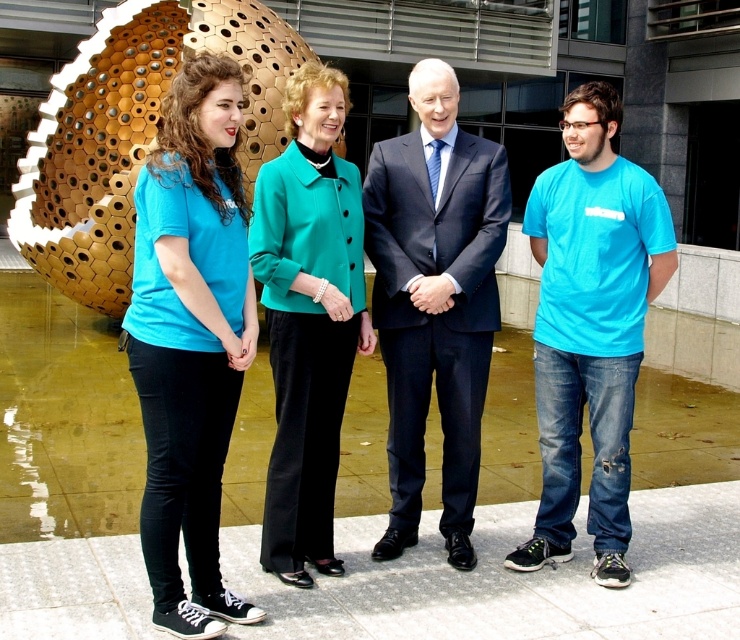
You are a photographer positioned at the center of the plaza. You need to capture a photo of the dark blue suit at center while avoiding the golden honeycomb sculpture in the background. Based on their positions, can you frame the shot so the sculpture is out of view?

The dark blue suit at center is located at point (434, 300). Since the golden honeycomb sculpture is behind the group, positioning the camera to focus on the dark blue suit at center while angling slightly away from the sculpture can exclude it from the frame.